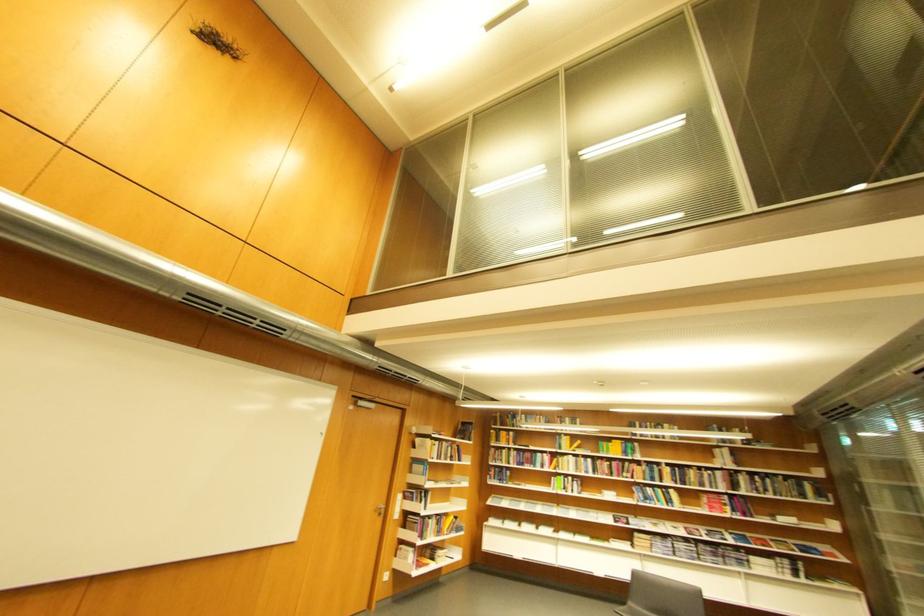
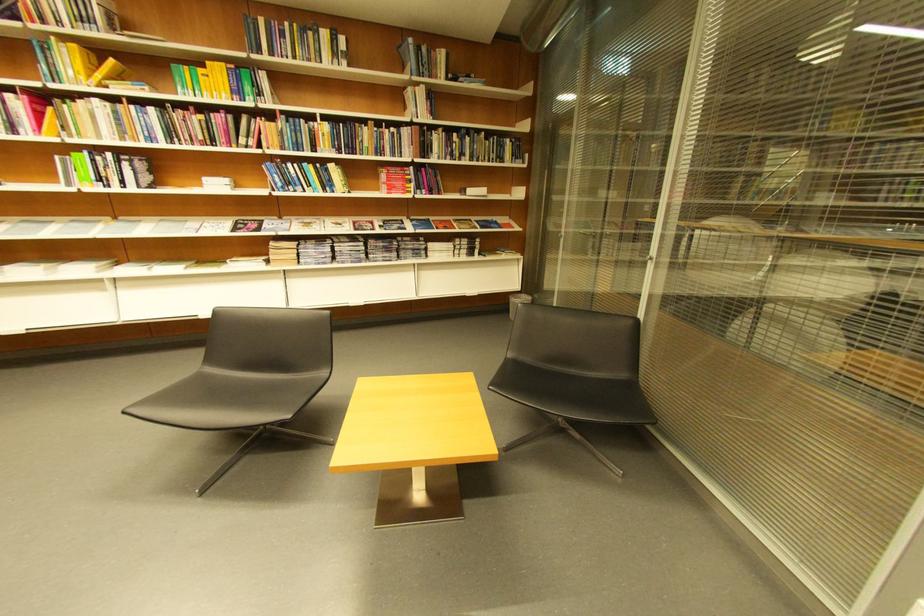
The point at (629, 443) is marked in the first image. Where is the corresponding point in the second image?

(234, 66)